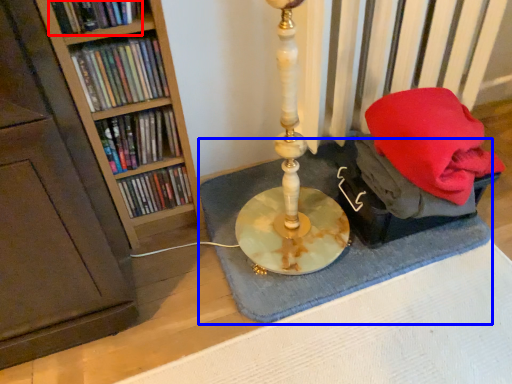
Question: Among these objects, which one is nearest to the camera, book (highlighted by a red box) or bath mat (highlighted by a blue box)?

Choices:
 (A) book
 (B) bath mat

Answer: (A)